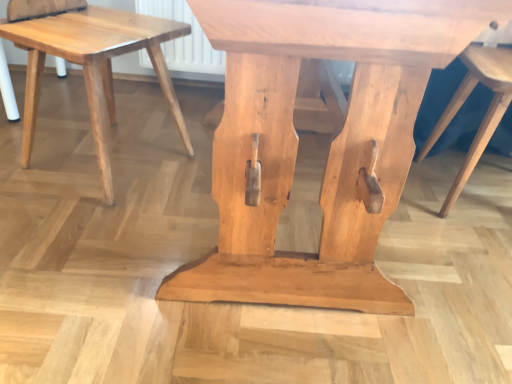
Question: Can you confirm if natural wood stool at center, acting as the 2th stool starting from the left, is shorter than natural wood stool at lower left, the 2th stool positioned from the right?

Choices:
 (A) yes
 (B) no

Answer: (B)

Question: From a real-world perspective, is natural wood stool at center, the 1th stool in the right-to-left sequence, on natural wood stool at lower left, arranged as the first stool when viewed from the left?

Choices:
 (A) yes
 (B) no

Answer: (A)

Question: Does natural wood stool at center, acting as the 2th stool starting from the left, have a lesser width compared to natural wood stool at lower left, the 2th stool positioned from the right?

Choices:
 (A) no
 (B) yes

Answer: (B)

Question: Considering the relative sizes of natural wood stool at center, acting as the 2th stool starting from the left, and natural wood stool at lower left, arranged as the first stool when viewed from the left, in the image provided, is natural wood stool at center, acting as the 2th stool starting from the left, smaller than natural wood stool at lower left, arranged as the first stool when viewed from the left,?

Choices:
 (A) no
 (B) yes

Answer: (A)

Question: Would you say natural wood stool at lower left, the 2th stool positioned from the right, is part of natural wood stool at center, acting as the 2th stool starting from the left,'s contents?

Choices:
 (A) yes
 (B) no

Answer: (B)

Question: Does natural wood stool at center, the 1th stool in the right-to-left sequence, appear on the right side of natural wood stool at lower left, the 2th stool positioned from the right?

Choices:
 (A) yes
 (B) no

Answer: (A)

Question: From a real-world perspective, is natural wood stool at lower left, arranged as the first stool when viewed from the left, under natural wood stool at center, the 1th stool in the right-to-left sequence?

Choices:
 (A) no
 (B) yes

Answer: (B)

Question: Could you tell me if natural wood stool at lower left, the 2th stool positioned from the right, is turned towards natural wood stool at center, the 1th stool in the right-to-left sequence?

Choices:
 (A) yes
 (B) no

Answer: (B)

Question: Is natural wood stool at lower left, the 2th stool positioned from the right, located outside natural wood stool at center, the 1th stool in the right-to-left sequence?

Choices:
 (A) yes
 (B) no

Answer: (A)

Question: Can you confirm if natural wood stool at lower left, the 2th stool positioned from the right, is positioned to the right of natural wood stool at center, acting as the 2th stool starting from the left?

Choices:
 (A) no
 (B) yes

Answer: (A)

Question: Does natural wood stool at lower left, the 2th stool positioned from the right, have a larger size compared to natural wood stool at center, the 1th stool in the right-to-left sequence?

Choices:
 (A) yes
 (B) no

Answer: (B)

Question: Is natural wood stool at lower left, the 2th stool positioned from the right, wider than natural wood stool at center, acting as the 2th stool starting from the left?

Choices:
 (A) yes
 (B) no

Answer: (A)

Question: Would you say natural wood stool at center, acting as the 2th stool starting from the left, is inside or outside natural wood stool at lower left, arranged as the first stool when viewed from the left?

Choices:
 (A) outside
 (B) inside

Answer: (A)